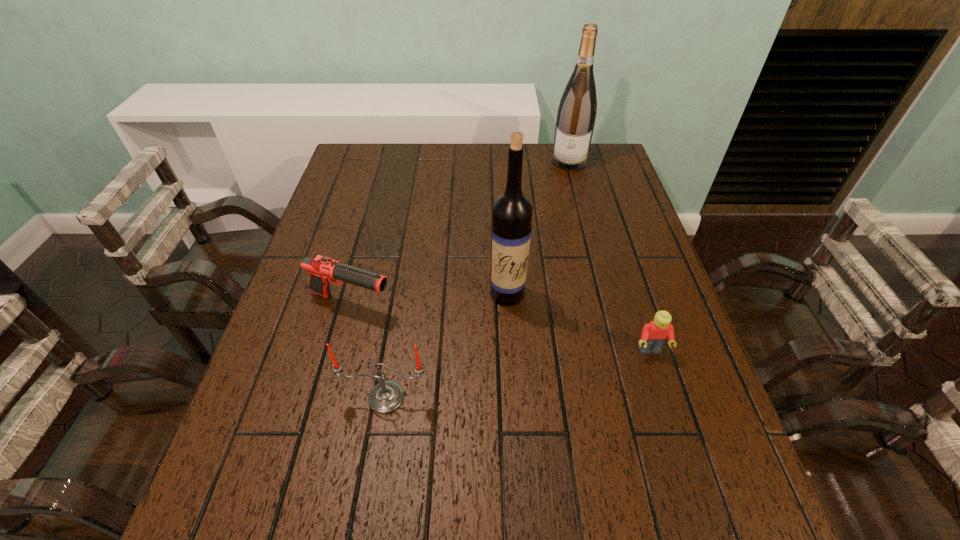
Locate an element on the screen. The width and height of the screenshot is (960, 540). the third tallest object is located at coordinates (385, 397).

The width and height of the screenshot is (960, 540). Identify the location of the nearest object. (385, 397).

Locate an element on the screen. Image resolution: width=960 pixels, height=540 pixels. the fourth farthest object is located at coordinates (654, 335).

Identify the location of the nearer wine bottle. This screenshot has height=540, width=960. (511, 228).

The height and width of the screenshot is (540, 960). I want to click on the third object from right to left, so click(x=511, y=228).

Identify the location of the farther wine bottle. This screenshot has width=960, height=540. (576, 115).

Where is `the right wine bottle`? The image size is (960, 540). the right wine bottle is located at coordinates (576, 115).

Find the location of a particular element. The width and height of the screenshot is (960, 540). gun is located at coordinates (322, 270).

Locate an element on the screen. vacant space located 0.090m on the front-facing side of the third shortest object is located at coordinates (376, 460).

The width and height of the screenshot is (960, 540). I want to click on vacant position located on the face of the Lego, so click(676, 431).